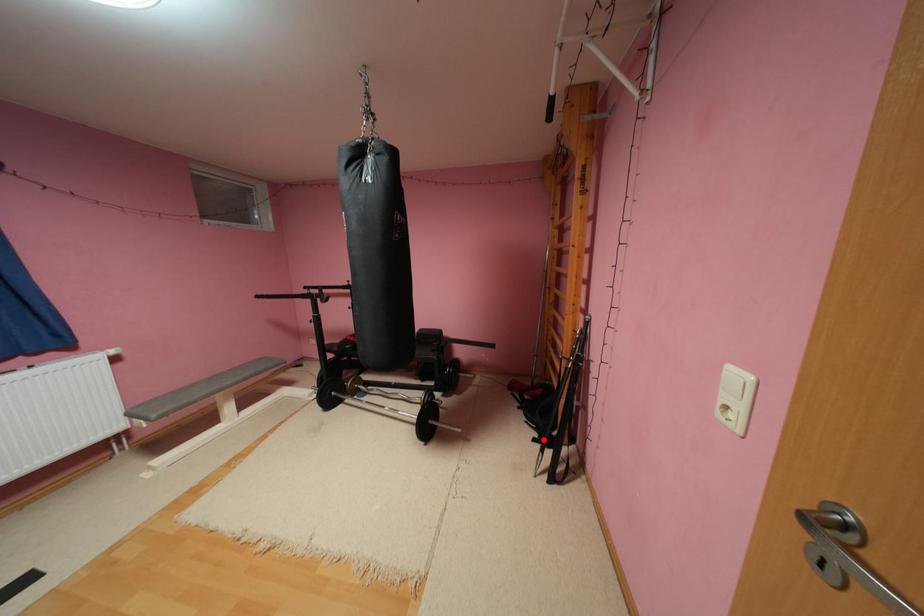
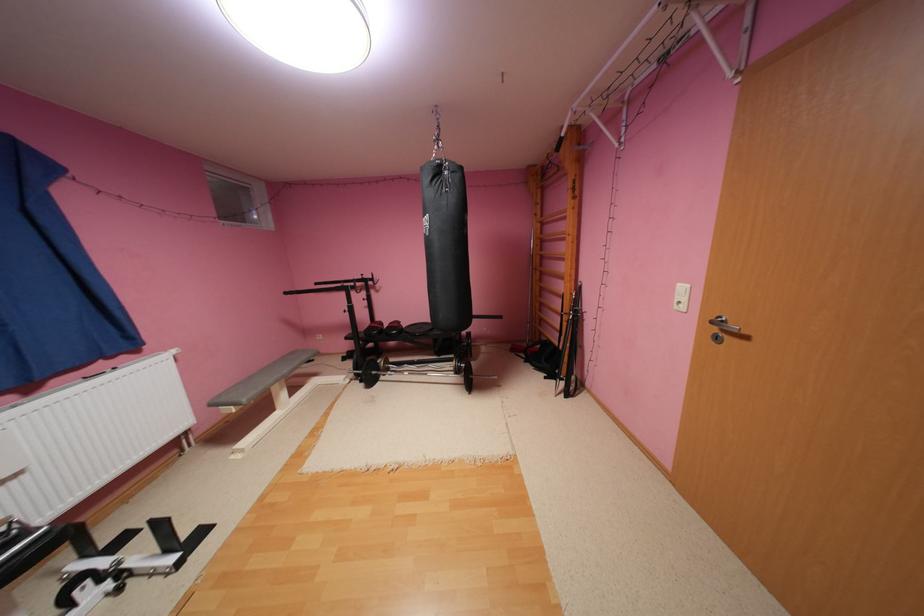
Where in the second image is the point corresponding to the highlighted location from the first image?

(554, 378)